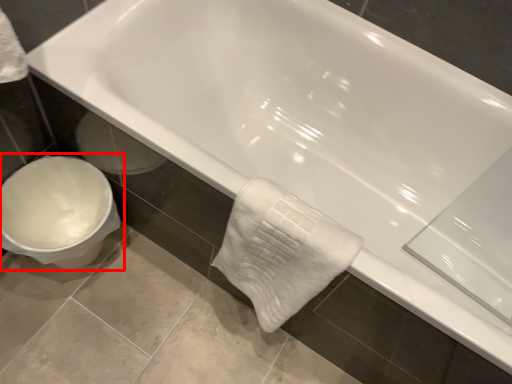
Question: From the image's perspective, where is toilet (annotated by the red box) located relative to bath towel?

Choices:
 (A) above
 (B) below

Answer: (A)